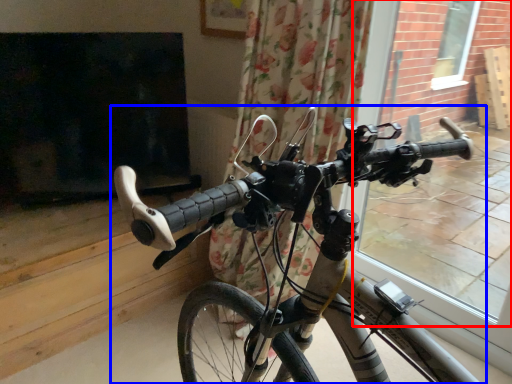
Question: Among these objects, which one is farthest to the camera, window frame (highlighted by a red box) or bicycle (highlighted by a blue box)?

Choices:
 (A) window frame
 (B) bicycle

Answer: (A)